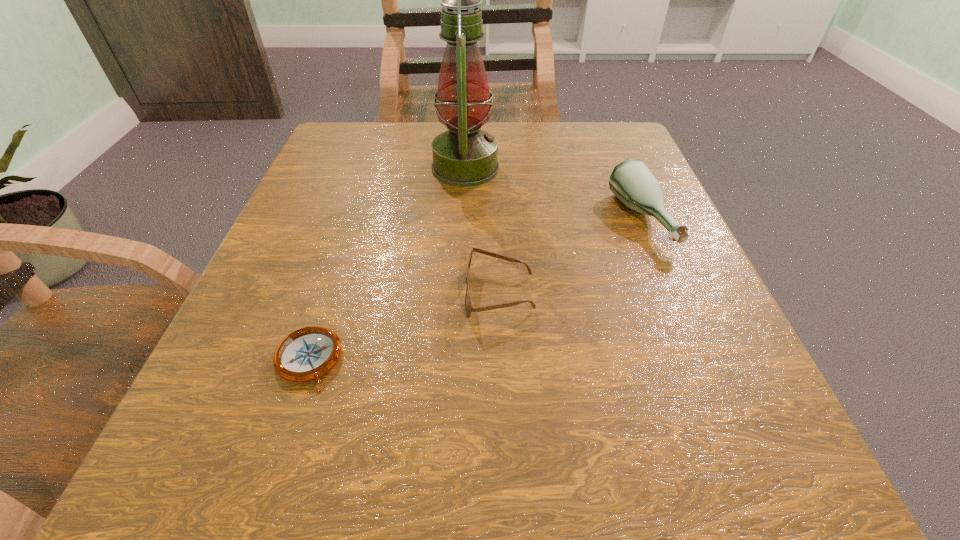
Image resolution: width=960 pixels, height=540 pixels. In the image, there is a desktop. Find the location of `free space at the far left corner`. free space at the far left corner is located at coordinates (337, 129).

Locate an element on the screen. The image size is (960, 540). vacant area at the near left corner is located at coordinates (187, 492).

Find the location of a particular element. This screenshot has height=540, width=960. free space at the far right corner of the desktop is located at coordinates click(614, 142).

In order to click on free region at the near right corner in this screenshot , I will do `click(732, 447)`.

The width and height of the screenshot is (960, 540). In order to click on vacant area that lies between the second tallest object and the oil lamp in this screenshot , I will do `click(552, 194)`.

In order to click on vacant area that lies between the sunglasses and the tallest object in this screenshot , I will do `click(482, 231)`.

Identify the location of vacant area that lies between the second nearest object and the bottle. (569, 257).

Where is `unoccupied position between the third tallest object and the shortest object`? The width and height of the screenshot is (960, 540). unoccupied position between the third tallest object and the shortest object is located at coordinates (404, 327).

I want to click on vacant area that lies between the third tallest object and the bottle, so click(569, 257).

You are a GUI agent. You are given a task and a screenshot of the screen. Output one action in this format:
    pyautogui.click(x=<x>, y=<y>)
    Task: Click on the free space between the oil lamp and the compass
    
    Given the screenshot: What is the action you would take?
    tap(387, 264)